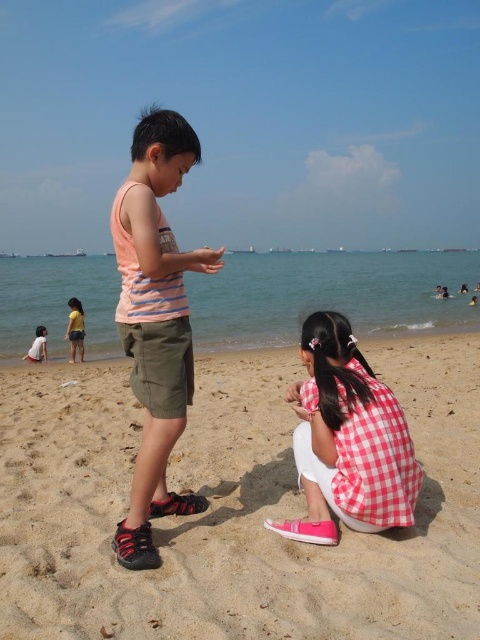
You are a photographer trying to capture both the red checkered shirt at lower center and the white cotton shirt at lower left in the same frame. Which shirt should you focus on first to ensure both are in the frame?

The red checkered shirt at lower center is taller than the white cotton shirt at lower left, so you should focus on the white cotton shirt at lower left first to ensure both are in the frame.

You are a photographer trying to capture a photo of the sandy beach at center and the red checkered shirt at lower center. Which object should you focus on first to ensure both are in the frame?

The sandy beach at center is in front of the red checkered shirt at lower center, so you should focus on the sandy beach at center first to ensure both are in the frame.